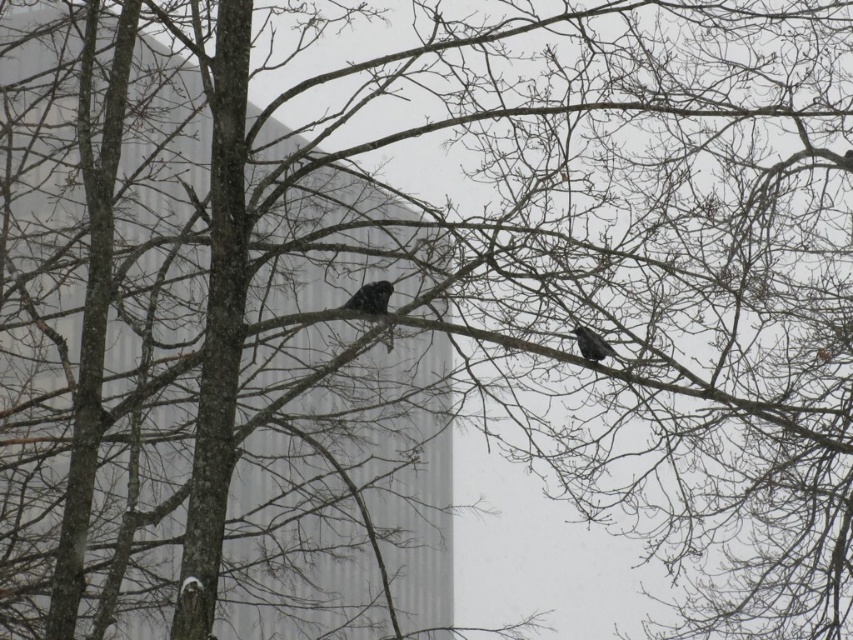
Which is in front, point (380, 300) or point (595, 342)?

Point (595, 342) is in front.

Does point (387, 284) come closer to viewer compared to point (577, 328)?

Yes.

Does point (350, 305) lie behind point (614, 353)?

No, it is in front of (614, 353).

The image size is (853, 640). In order to click on spotted black bird at center in this screenshot , I will do `click(370, 298)`.